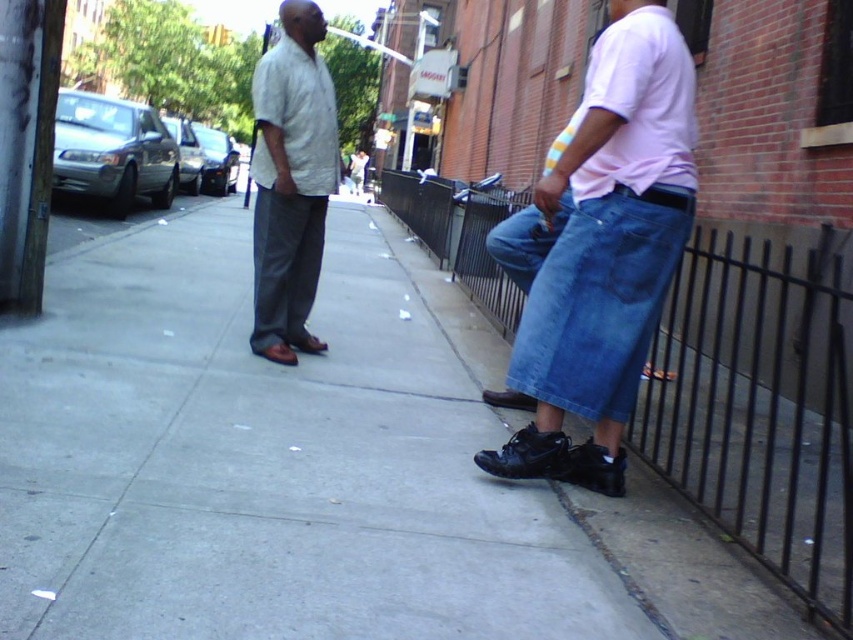
Does concrete sidewalk at center have a lesser width compared to black leather sandal at lower right?

No.

Can you confirm if concrete sidewalk at center is bigger than black leather sandal at lower right?

Indeed, concrete sidewalk at center has a larger size compared to black leather sandal at lower right.

Find the location of a particular element. This screenshot has height=640, width=853. concrete sidewalk at center is located at coordinates (265, 461).

Is denim jeans at right to the right of blue denim jeans at lower right from the viewer's perspective?

Correct, you'll find denim jeans at right to the right of blue denim jeans at lower right.

Which of these two, denim jeans at right or blue denim jeans at lower right, stands shorter?

blue denim jeans at lower right

Does point (608, 248) come closer to viewer compared to point (416, 280)?

Yes.

The width and height of the screenshot is (853, 640). I want to click on denim jeans at right, so click(x=605, y=250).

Is the position of concrete sidewalk at center less distant than that of denim at right?

That is True.

Is concrete sidewalk at center taller than denim at right?

Yes.

Where is `concrete sidewalk at center`? concrete sidewalk at center is located at coordinates (265, 461).